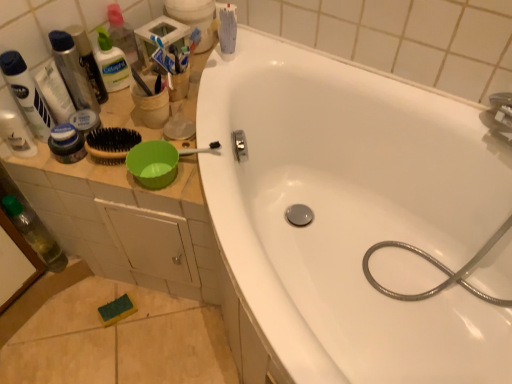
Question: Is white glossy bathtub at upper center taller or shorter than clear plastic bottle at upper left, marked as the first bottle in a top-to-bottom arrangement?

Choices:
 (A) tall
 (B) short

Answer: (A)

Question: Visually, is white glossy bathtub at upper center positioned to the left or to the right of clear plastic bottle at upper left, the 2th bottle positioned from the bottom?

Choices:
 (A) left
 (B) right

Answer: (B)

Question: Estimate the real-world distances between objects in this image. Which object is farther from the white glossy bathtub at upper center?

Choices:
 (A) matte white tube at upper left, the third toiletry from the right
 (B) green plastic bottle at left, acting as the second bottle starting from the top
 (C) clear plastic bottle at upper left, the 2th bottle positioned from the bottom
 (D) shiny metallic can at upper left, the 4th toiletry from the left
 (E) matte black jar at left, the 2th toiletry viewed from the right

Answer: (B)

Question: Estimate the real-world distances between objects in this image. Which object is farther from the green plastic bottle at left, the first bottle in the bottom-to-top sequence?

Choices:
 (A) translucent plastic bottle at upper left, which is the first toiletry in left-to-right order
 (B) white glossy bathtub at upper center
 (C) brown bristle brush at upper left
 (D) clear plastic bottle at upper left, which is the 1th bottle in right-to-left order
 (E) matte white tube at upper left, the third toiletry from the right

Answer: (B)